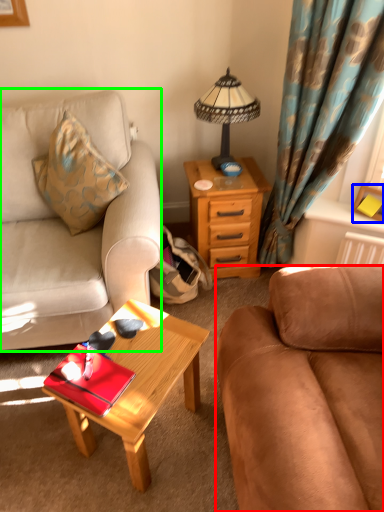
Question: Which object is the closest to the studio couch (highlighted by a red box)? Choose among these: picture frame (highlighted by a blue box) or studio couch (highlighted by a green box).

Choices:
 (A) picture frame
 (B) studio couch

Answer: (B)